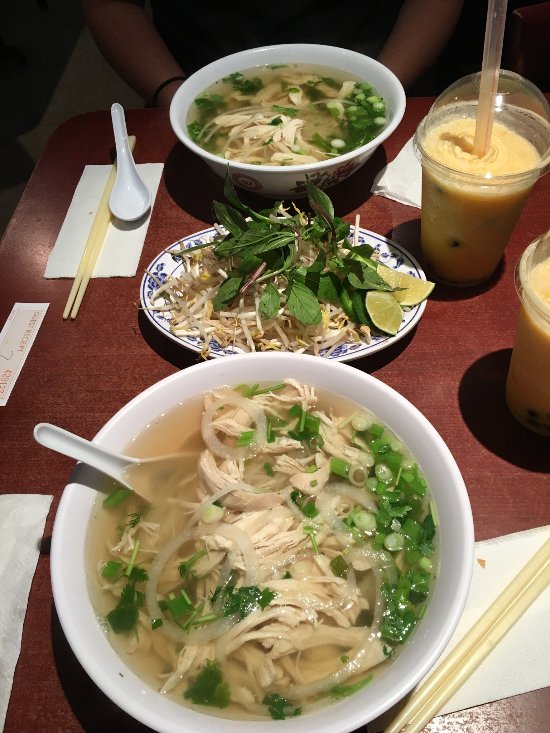
Identify the location of table. (98, 357).